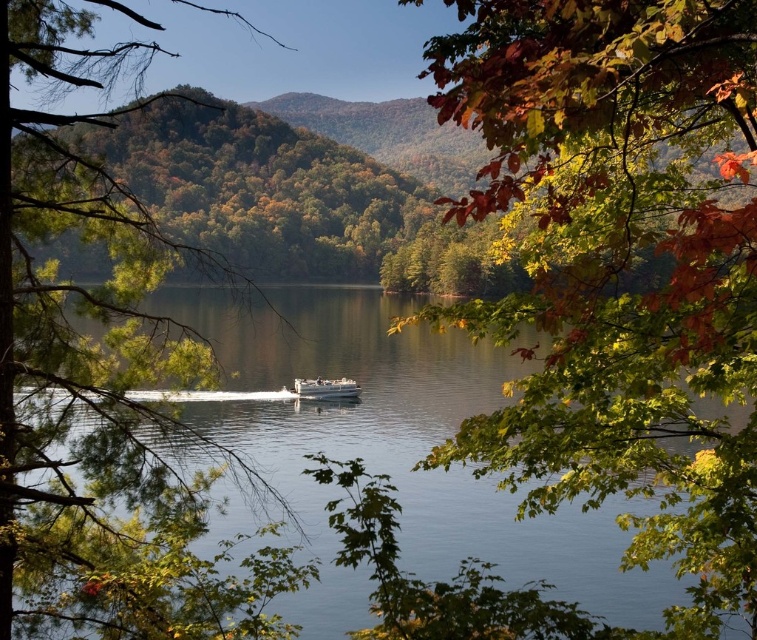
Question: Which object is the farthest from the green matte tree at center?

Choices:
 (A) clear blue water at center
 (B) autumn leaves at upper right

Answer: (A)

Question: Based on their relative distances, which object is nearer to the green matte tree at center?

Choices:
 (A) autumn leaves at upper right
 (B) white plastic boat at center

Answer: (A)

Question: Which of the following is the closest to the observer?

Choices:
 (A) green matte tree at center
 (B) clear blue water at center
 (C) white plastic boat at center

Answer: (A)

Question: Is green matte tree at center wider than white plastic boat at center?

Choices:
 (A) no
 (B) yes

Answer: (B)

Question: Does autumn leaves at upper right appear under white plastic boat at center?

Choices:
 (A) yes
 (B) no

Answer: (B)

Question: Can you confirm if clear blue water at center is positioned to the left of white plastic boat at center?

Choices:
 (A) yes
 (B) no

Answer: (B)